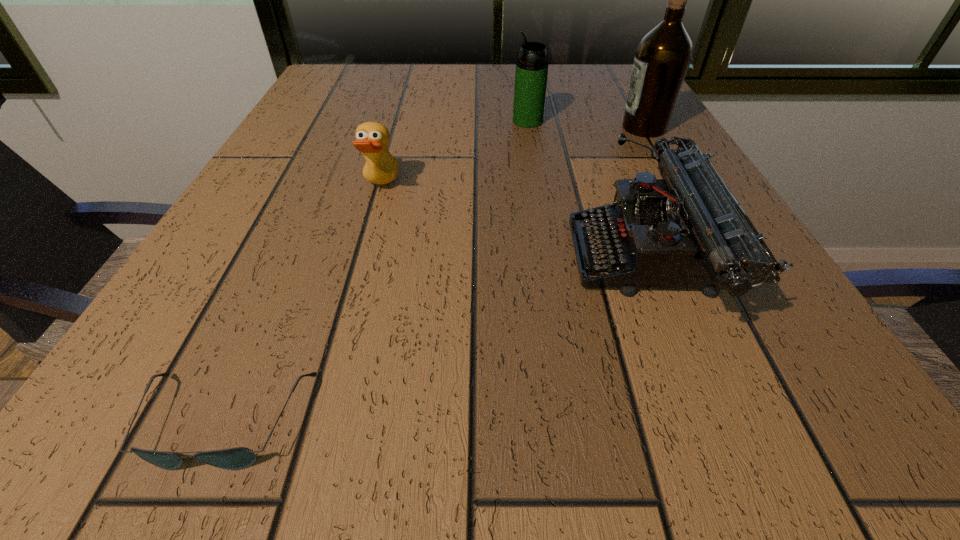
You are a GUI agent. You are given a task and a screenshot of the screen. Output one action in this format:
    pyautogui.click(x=<x>, y=<y>)
    Task: Click on the object present at the near left corner
    Image resolution: width=960 pixels, height=540 pixels.
    Given the screenshot: What is the action you would take?
    pyautogui.click(x=237, y=458)

The width and height of the screenshot is (960, 540). Find the location of `vacant space at the far edge`. vacant space at the far edge is located at coordinates (484, 96).

Identify the location of free space at the left edge. This screenshot has width=960, height=540. (282, 294).

Where is `free spot at the far left corner of the desktop`? The width and height of the screenshot is (960, 540). free spot at the far left corner of the desktop is located at coordinates (341, 100).

This screenshot has height=540, width=960. What are the coordinates of `free area in between the sunglasses and the typewriter` in the screenshot? It's located at (436, 340).

Where is `vacant region between the tallest object and the duck`? The image size is (960, 540). vacant region between the tallest object and the duck is located at coordinates (513, 157).

Locate an element on the screen. vacant space that's between the fourth shortest object and the typewriter is located at coordinates (588, 190).

The width and height of the screenshot is (960, 540). Find the location of `unoccupied position between the sunglasses and the typewriter`. unoccupied position between the sunglasses and the typewriter is located at coordinates (436, 340).

The height and width of the screenshot is (540, 960). In order to click on blank region between the tallest object and the duck in this screenshot , I will do `click(513, 157)`.

I want to click on free spot between the fourth shortest object and the shortest object, so click(x=376, y=271).